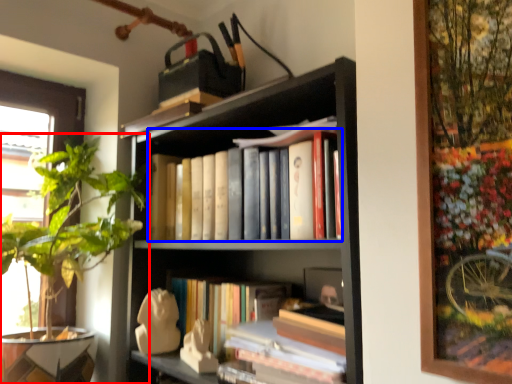
Question: Which point is closer to the camera, houseplant (highlighted by a red box) or book (highlighted by a blue box)?

Choices:
 (A) houseplant
 (B) book

Answer: (A)